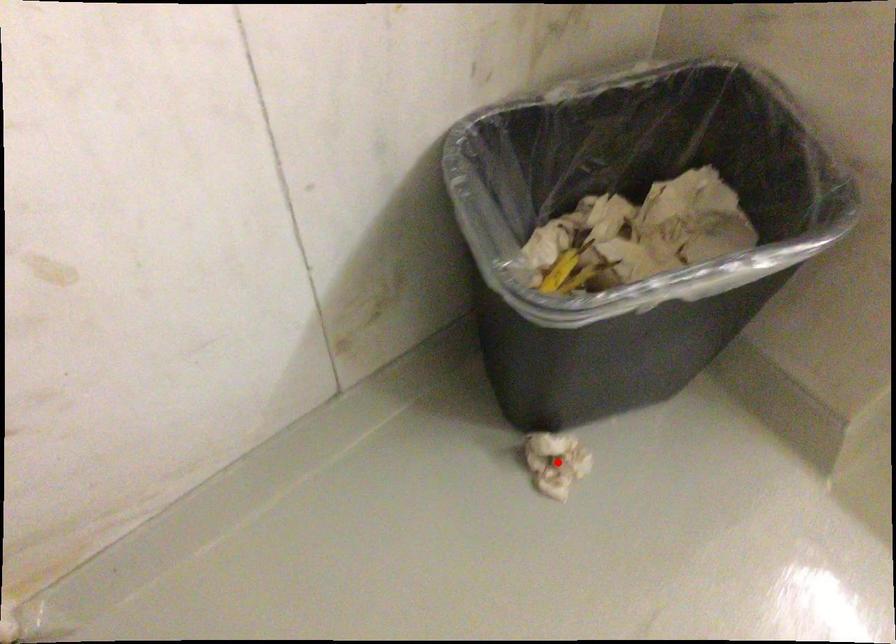
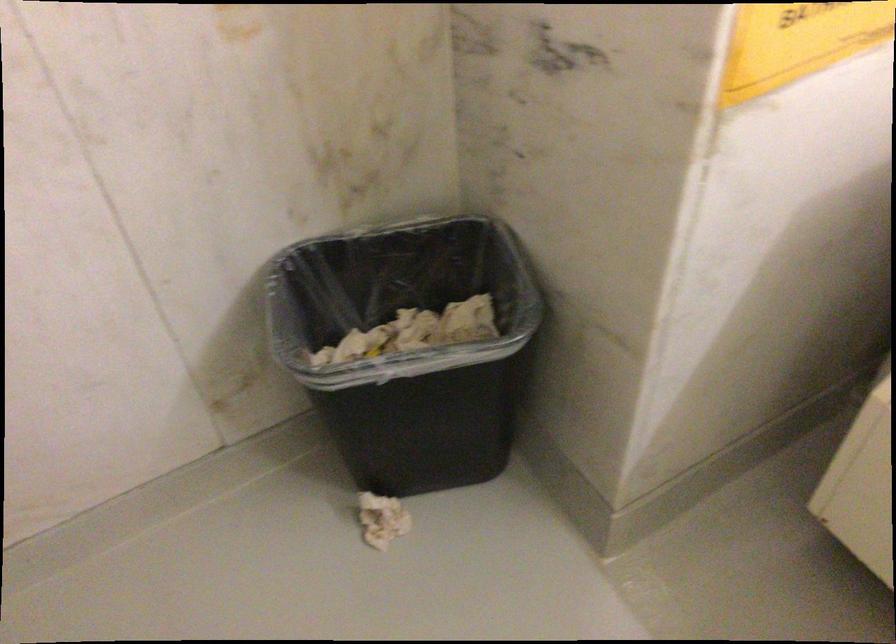
Question: I am providing you with two images of the same scene from different viewpoints. In image1, a red point is highlighted. Considering the same 3D point in image2, which of the following is correct?

Choices:
 (A) It is closer
 (B) It is farther

Answer: (B)